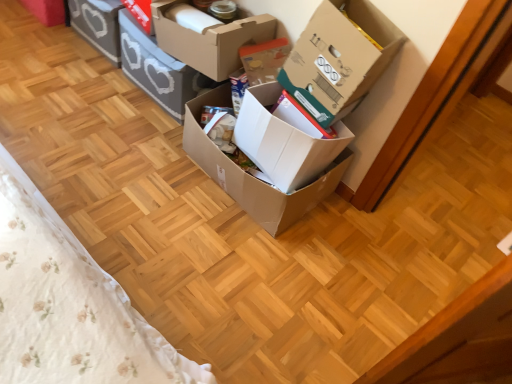
What are the coordinates of `vacant space in front of brown cardboard box at center, the third box positioned from the right` in the screenshot? It's located at (225, 264).